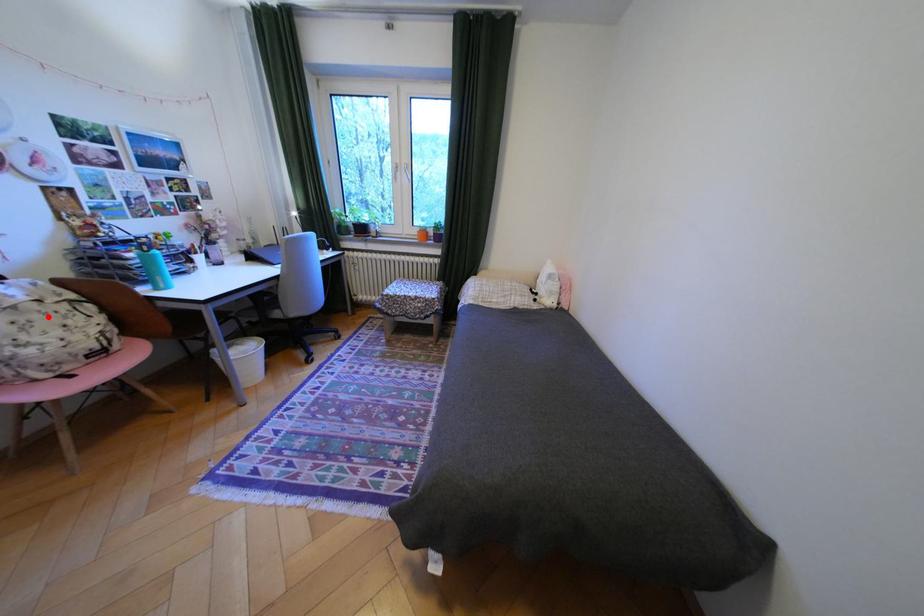
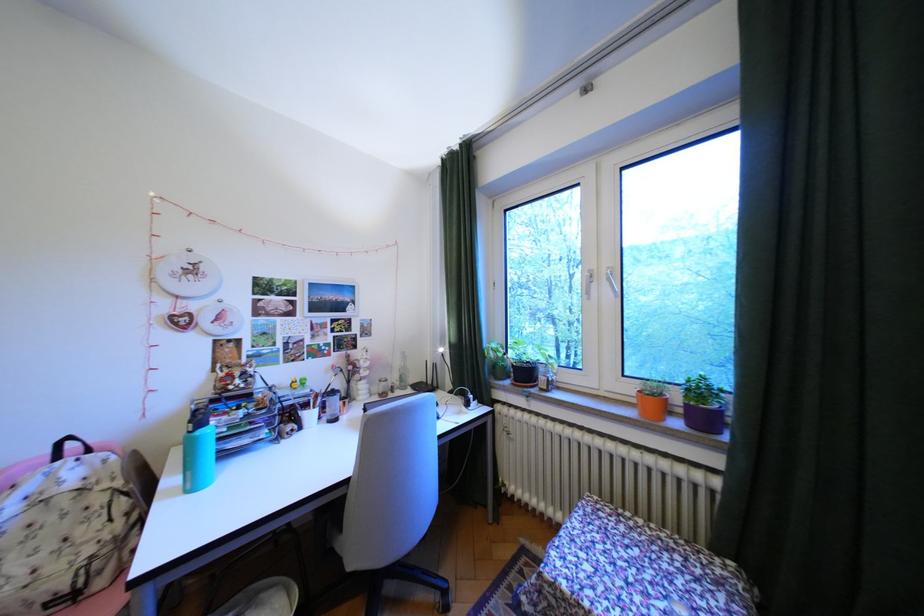
The point at the highlighted location is marked in the first image. Where is the corresponding point in the second image?

(65, 519)